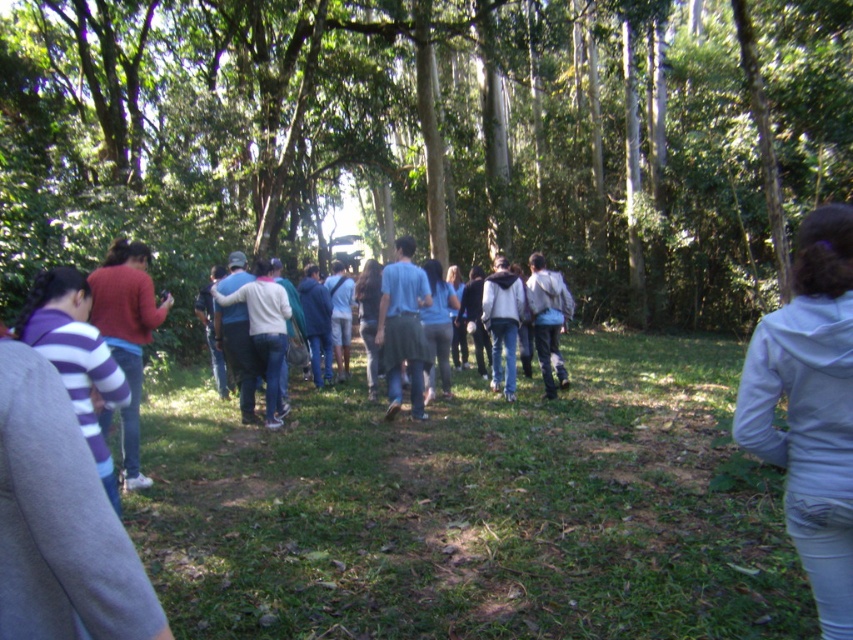
You are standing in the forest and see two points marked in the image. Which point is closer to you, point (91, 273) or point (440, 310)?

Point (91, 273) is closer to the viewer than point (440, 310).

You are a photographer trying to capture a photo of the blue cotton shirt at center while ensuring the green leafy tree at center is partially visible in the background. Based on their sizes, do you think you can frame the shot so that the tree is entirely behind the shirt without overlapping?

The green leafy tree at center might be wider than blue cotton shirt at center, so there is a possibility that the tree could extend beyond the shirt in width. To frame the shot so the tree is entirely behind the shirt without overlapping, you would need to adjust the camera angle or distance to ensure the tree fits within the shirt area. However, since the tree might be wider, this might not be possible without cropping or moving the subjects.

You are a photographer trying to capture a clear photo of the blue cotton shirt at center without any obstruction. Given that the green leafy tree at center is blocking the view, can you adjust your position to take the shot?

The blue cotton shirt at center is behind the green leafy tree at center, so you can move to a position where the tree is no longer between you and the shirt to capture a clear photo.